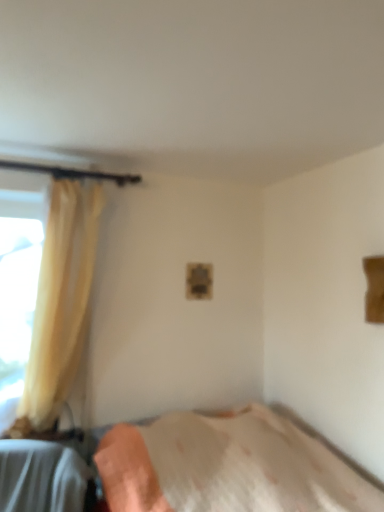
Where is `white textured bed at lower center`? white textured bed at lower center is located at coordinates (227, 467).

Describe the element at coordinates (227, 467) in the screenshot. I see `white textured bed at lower center` at that location.

Measure the distance between point (237, 485) and camera.

A distance of 2.23 meters exists between point (237, 485) and camera.

Where is `yellow fabric curtain at left`? Image resolution: width=384 pixels, height=512 pixels. yellow fabric curtain at left is located at coordinates (60, 302).

Describe the element at coordinates (60, 302) in the screenshot. I see `yellow fabric curtain at left` at that location.

Find the location of a particular element. The height and width of the screenshot is (512, 384). white textured bed at lower center is located at coordinates (227, 467).

Can you confirm if yellow fabric curtain at left is positioned to the right of white textured bed at lower center?

In fact, yellow fabric curtain at left is to the left of white textured bed at lower center.

Is yellow fabric curtain at left in front of white textured bed at lower center?

No, the depth of yellow fabric curtain at left is greater than that of white textured bed at lower center.

Does point (92, 189) appear closer or farther from the camera than point (67, 458)?

Point (92, 189) is positioned farther from the camera compared to point (67, 458).

From the image's perspective, is yellow fabric curtain at left located above white textured bed at lower center?

Yes, from the image's perspective, yellow fabric curtain at left is above white textured bed at lower center.

From a real-world perspective, is yellow fabric curtain at left under white textured bed at lower center?

No, from a real-world perspective, yellow fabric curtain at left is not beneath white textured bed at lower center.

Is yellow fabric curtain at left wider than white textured bed at lower center?

In fact, yellow fabric curtain at left might be narrower than white textured bed at lower center.

Can you confirm if yellow fabric curtain at left is taller than white textured bed at lower center?

Correct, yellow fabric curtain at left is much taller as white textured bed at lower center.

Does yellow fabric curtain at left have a larger size compared to white textured bed at lower center?

Incorrect, yellow fabric curtain at left is not larger than white textured bed at lower center.

Do you think yellow fabric curtain at left is within white textured bed at lower center, or outside of it?

yellow fabric curtain at left is located beyond the bounds of white textured bed at lower center.

Is yellow fabric curtain at left positioned far away from white textured bed at lower center?

No, yellow fabric curtain at left is not far away from white textured bed at lower center.

Does yellow fabric curtain at left turn towards white textured bed at lower center?

No, yellow fabric curtain at left is not turned towards white textured bed at lower center.

Can you tell me how much yellow fabric curtain at left and white textured bed at lower center differ in facing direction?

The facing directions of yellow fabric curtain at left and white textured bed at lower center are 88.6 degrees apart.

At what (x,y) coordinates should I click in order to perform the action: click on bed lying below the yellow fabric curtain at left (from the image's perspective). Please return your answer as a coordinate pair (x, y). This screenshot has height=512, width=384. Looking at the image, I should click on (227, 467).

Considering the positions of objects white textured bed at lower center and yellow fabric curtain at left in the image provided, who is more to the right, white textured bed at lower center or yellow fabric curtain at left?

Positioned to the right is white textured bed at lower center.

Is the depth of white textured bed at lower center less than that of yellow fabric curtain at left?

Yes, it is.

Which is closer to the camera, (78, 483) or (69, 309)?

The point (78, 483) is closer.

From the image's perspective, between white textured bed at lower center and yellow fabric curtain at left, who is located below?

From the image's view, white textured bed at lower center is below.

From a real-world perspective, who is located lower, white textured bed at lower center or yellow fabric curtain at left?

From a 3D spatial view, white textured bed at lower center is below.

Between white textured bed at lower center and yellow fabric curtain at left, which one has smaller width?

With smaller width is yellow fabric curtain at left.

Does white textured bed at lower center have a greater height compared to yellow fabric curtain at left?

Incorrect, the height of white textured bed at lower center is not larger of that of yellow fabric curtain at left.

Considering the relative sizes of white textured bed at lower center and yellow fabric curtain at left in the image provided, is white textured bed at lower center smaller than yellow fabric curtain at left?

Incorrect, white textured bed at lower center is not smaller in size than yellow fabric curtain at left.

Is white textured bed at lower center positioned beyond the bounds of yellow fabric curtain at left?

That's correct, white textured bed at lower center is outside of yellow fabric curtain at left.

Are white textured bed at lower center and yellow fabric curtain at left making contact?

No, white textured bed at lower center is not with yellow fabric curtain at left.

Is white textured bed at lower center facing away from yellow fabric curtain at left?

white textured bed at lower center is not turned away from yellow fabric curtain at left.

Find the location of `curtain on the left of white textured bed at lower center`. curtain on the left of white textured bed at lower center is located at coordinates (60, 302).

Find the location of a particular element. This screenshot has height=512, width=384. bed that is in front of the yellow fabric curtain at left is located at coordinates (227, 467).

Find the location of a particular element. bed below the yellow fabric curtain at left (from a real-world perspective) is located at coordinates (227, 467).